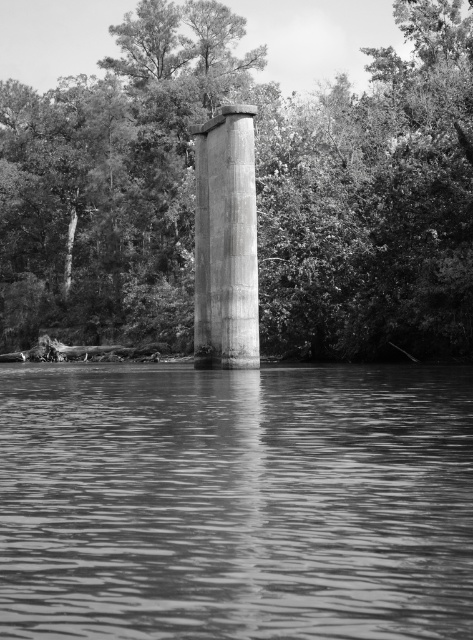
Question: Which object is positioned closest to the concrete column at center?

Choices:
 (A) smooth water at center
 (B) smooth green tree at center

Answer: (B)

Question: Is smooth green tree at center further to the viewer compared to concrete column at center?

Choices:
 (A) yes
 (B) no

Answer: (A)

Question: Is smooth green tree at center above concrete column at center?

Choices:
 (A) yes
 (B) no

Answer: (A)

Question: Which object is closer to the camera taking this photo?

Choices:
 (A) smooth green tree at center
 (B) concrete column at center
 (C) smooth water at center

Answer: (C)

Question: Among these objects, which one is farthest from the camera?

Choices:
 (A) concrete column at center
 (B) smooth water at center

Answer: (A)

Question: Does smooth green tree at center appear on the left side of concrete column at center?

Choices:
 (A) no
 (B) yes

Answer: (B)